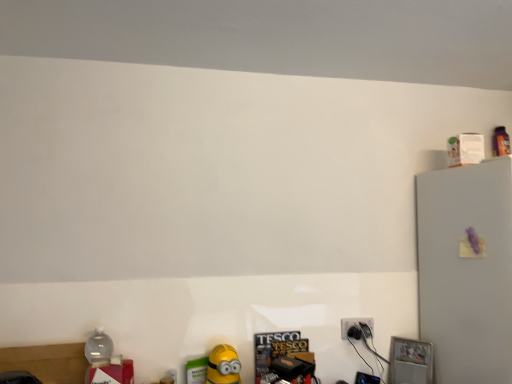
Question: Looking at their shapes, would you say black plastic power plugs and sockets at lower right is wider or thinner than yellow matte toy at lower center?

Choices:
 (A) thin
 (B) wide

Answer: (A)

Question: Is black plastic power plugs and sockets at lower right bigger or smaller than yellow matte toy at lower center?

Choices:
 (A) small
 (B) big

Answer: (A)

Question: Estimate the real-world distances between objects in this image. Which object is closer to the white matte refrigerator at upper right?

Choices:
 (A) yellow matte toy at lower center
 (B) transparent plastic bottle at lower left
 (C) black plastic power plugs and sockets at lower right

Answer: (C)

Question: Which is farther from the black plastic power plugs and sockets at lower right?

Choices:
 (A) yellow matte toy at lower center
 (B) transparent plastic bottle at lower left
 (C) white matte refrigerator at upper right

Answer: (B)